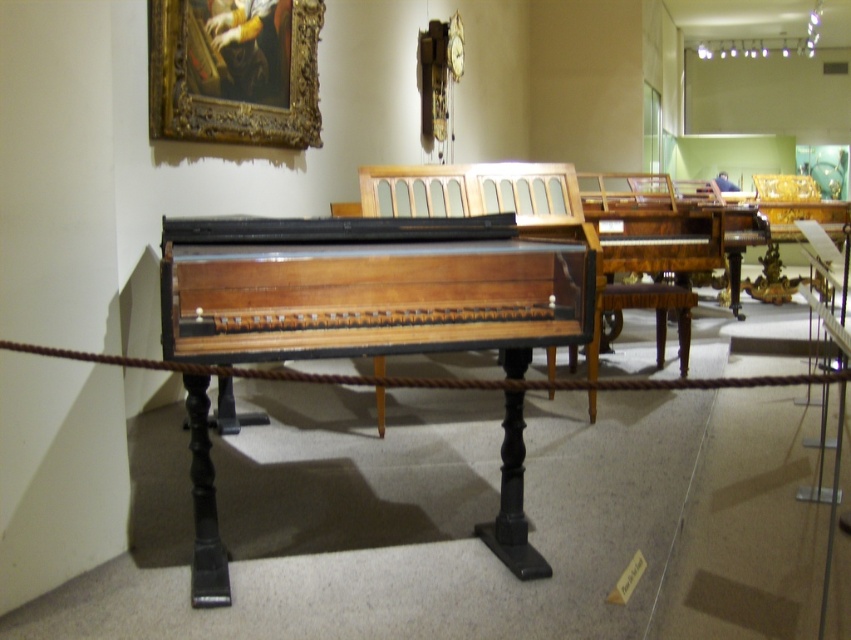
Can you confirm if wooden polished piano at center is thinner than gold ornate frame at upper left?

In fact, wooden polished piano at center might be wider than gold ornate frame at upper left.

Is point (538, 577) less distant than point (224, 120)?

Yes, point (538, 577) is in front of point (224, 120).

I want to click on wooden polished piano at center, so click(x=368, y=288).